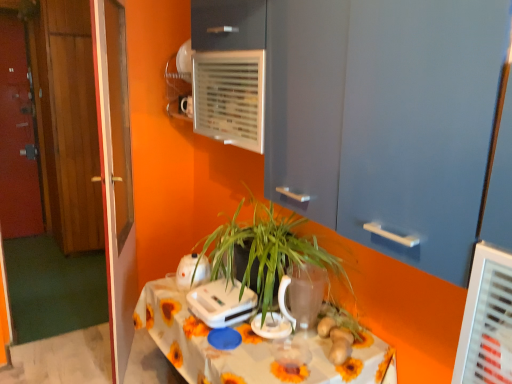
Question: Is point (345, 352) positioned closer to the camera than point (350, 357)?

Choices:
 (A) farther
 (B) closer

Answer: (B)

Question: From their relative heights in the image, would you say brown matte ginger at center is taller or shorter than white floral tablecloth at center?

Choices:
 (A) short
 (B) tall

Answer: (A)

Question: Which object is positioned farthest from the white plastic air conditioning unit at upper center?

Choices:
 (A) brown matte ginger at center
 (B) transparent glass door at left
 (C) red wooden door at left, which appears as the 4th door when viewed from the right
 (D) green matte plant at center
 (E) wooden door at left, which is the second door from right to left

Answer: (C)

Question: Considering the real-world distances, which object is closest to the brown matte ginger at center?

Choices:
 (A) transparent glass vase at center
 (B) white glossy kettle at center, marked as the third appliance in a left-to-right arrangement
 (C) wooden door at left, the second door when ordered from back to front
 (D) transparent glass door at left
 (E) red wooden door at left, which is the 1th door in back-to-front order

Answer: (B)